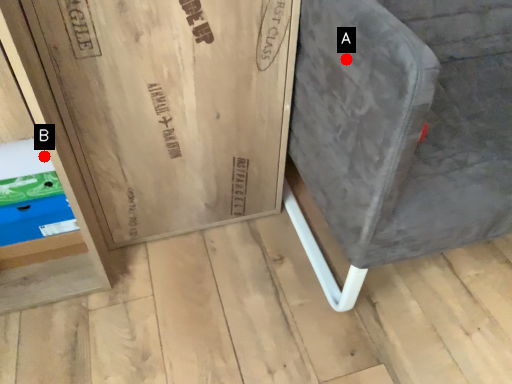
Question: Two points are circled on the image, labeled by A and B beside each circle. Which of the following is the closest to the observer?

Choices:
 (A) A is closer
 (B) B is closer

Answer: (A)